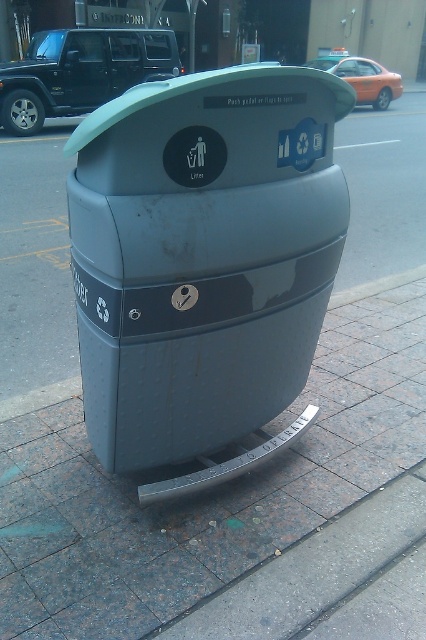
You are a pedestrian standing at the sidewalk next to the trash bin. You see the black matte suv at upper left and the orange matte car at upper right. Which car is closer to you?

The black matte suv at upper left is closer to you because it is in front of the orange matte car at upper right.

You are a person who just finished eating a snack and want to dispose of the wrapper. You are standing 1.37 meters away from the matte gray trash can at center. Can you reach the foot pedal to open it without moving closer?

The matte gray trash can at center and viewer are 1.37 meters apart from each other. Since the typical foot pedal requires the user to be within about 1 meter to effectively reach and press it, you would need to move closer to activate the pedal.